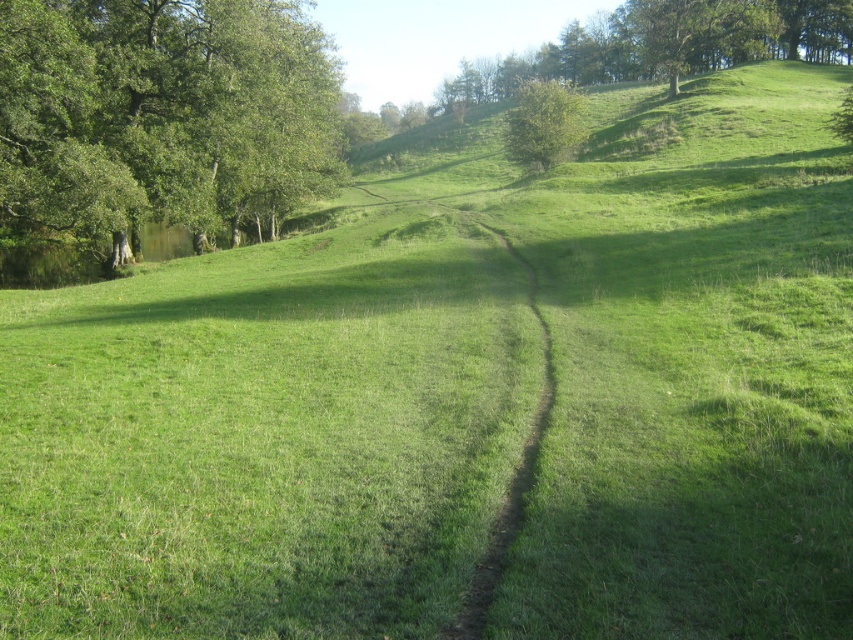
Question: Among these objects, which one is nearest to the camera?

Choices:
 (A) green leafy tree at left
 (B) green leafy tree at upper center

Answer: (A)

Question: Which point is farther to the camera?

Choices:
 (A) (x=534, y=92)
 (B) (x=165, y=106)

Answer: (A)

Question: Is green leafy tree at left closer to camera compared to green leafy tree at upper center?

Choices:
 (A) yes
 (B) no

Answer: (A)

Question: Can you confirm if green leafy tree at left is thinner than green leafy tree at upper center?

Choices:
 (A) yes
 (B) no

Answer: (A)

Question: Does green leafy tree at left appear on the left side of green leafy tree at upper center?

Choices:
 (A) yes
 (B) no

Answer: (A)